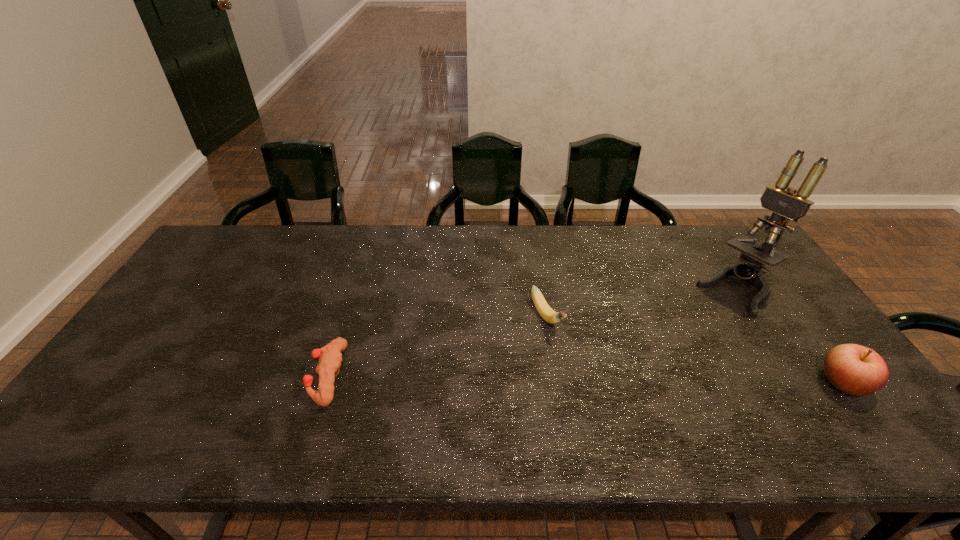
This screenshot has width=960, height=540. I want to click on free spot between the banana and the puncher, so click(x=437, y=347).

Image resolution: width=960 pixels, height=540 pixels. Identify the location of free space between the puncher and the third tallest object. (437, 347).

At what (x,y) coordinates should I click in order to perform the action: click on vacant space that is in between the tallest object and the third shortest object. Please return your answer as a coordinate pair (x, y). Image resolution: width=960 pixels, height=540 pixels. Looking at the image, I should click on pos(791,338).

Image resolution: width=960 pixels, height=540 pixels. What are the coordinates of `vacant point located between the second shortest object and the tallest object` in the screenshot? It's located at (642, 305).

You are a GUI agent. You are given a task and a screenshot of the screen. Output one action in this format:
    pyautogui.click(x=<x>, y=<y>)
    Task: Click on the empty location between the third tallest object and the third shortest object
    
    Given the screenshot: What is the action you would take?
    pyautogui.click(x=694, y=350)

Identify the location of vacant space that's between the third object from right to left and the apple. (694, 350).

In order to click on free area in between the shortest object and the second object from left to right in this screenshot , I will do `click(437, 347)`.

Locate which object is the closest to the leftmost object. Please provide its 2D coordinates. Your answer should be formatted as a tuple, i.e. [(x, y)], where the tuple contains the x and y coordinates of a point satisfying the conditions above.

[(545, 311)]

Locate an element on the screen. object that can be found as the third closest to the third object from right to left is located at coordinates (857, 370).